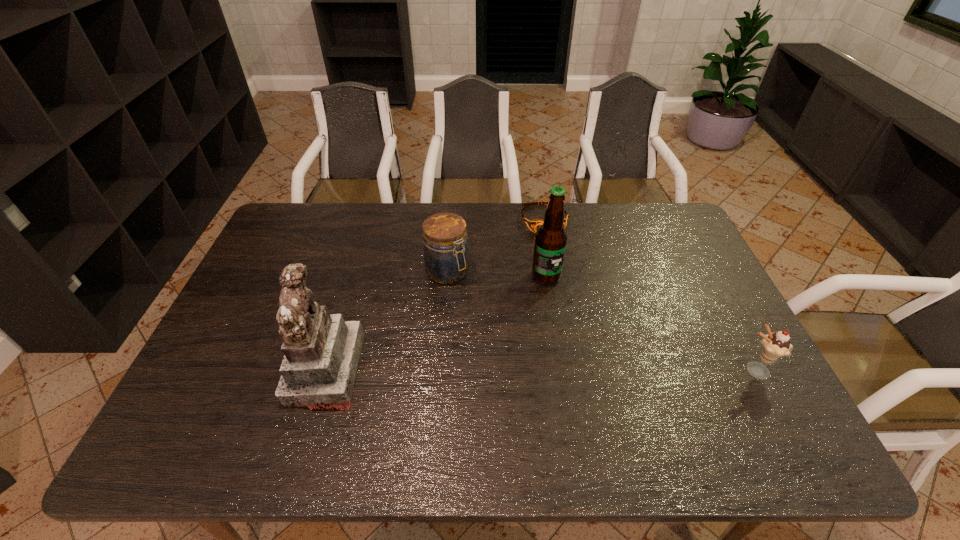
The image size is (960, 540). Find the location of `blank space located with the lenses facing forward on the farthest object`. blank space located with the lenses facing forward on the farthest object is located at coordinates (564, 275).

This screenshot has width=960, height=540. I want to click on vacant space located 0.390m with the lenses facing forward on the farthest object, so click(582, 321).

This screenshot has width=960, height=540. What are the coordinates of `vacant space situated with the lenses facing forward on the farthest object` in the screenshot? It's located at (573, 298).

Image resolution: width=960 pixels, height=540 pixels. What are the coordinates of `vacant space situated 0.320m on the label of the beer bottle` in the screenshot? It's located at (591, 375).

This screenshot has height=540, width=960. I want to click on vacant point located 0.190m on the label of the beer bottle, so click(573, 335).

At what (x,y) coordinates should I click in order to perform the action: click on free location located 0.270m on the label of the beer bottle. Please return your answer as a coordinate pair (x, y). Looking at the image, I should click on (585, 359).

Where is `blank area located 0.140m on the lid of the second object from left to right`? The image size is (960, 540). blank area located 0.140m on the lid of the second object from left to right is located at coordinates (488, 312).

Identify the location of free space located 0.210m on the lid of the second object from left to right. The width and height of the screenshot is (960, 540). (503, 327).

At what (x,y) coordinates should I click in order to perform the action: click on vacant space located on the lid of the second object from left to right. Please return your answer as a coordinate pair (x, y). Looking at the image, I should click on (501, 325).

Locate an element on the screen. The height and width of the screenshot is (540, 960). object that is at the far edge is located at coordinates (534, 223).